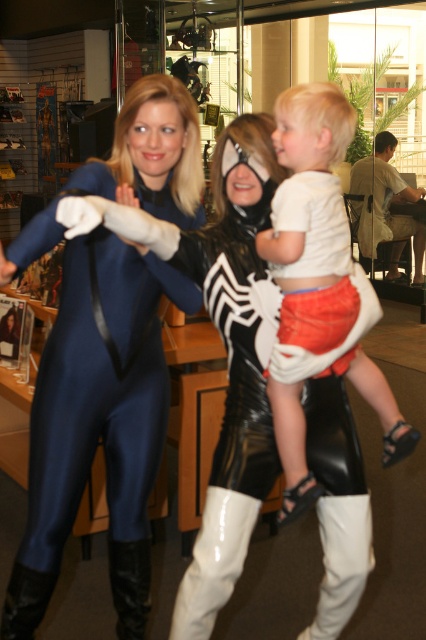
Does shiny blue bodysuit at center lie behind black leather boot at lower center?

No.

What do you see at coordinates (94, 410) in the screenshot?
I see `shiny blue bodysuit at center` at bounding box center [94, 410].

Which is behind, point (95, 444) or point (140, 556)?

Positioned behind is point (140, 556).

At what (x,y) coordinates should I click in order to perform the action: click on shiny blue bodysuit at center. Please return your answer as a coordinate pair (x, y). This screenshot has width=426, height=640. Looking at the image, I should click on (94, 410).

Can you confirm if shiny blue bodysuit at center is smaller than white cotton shirt at upper center?

Actually, shiny blue bodysuit at center might be larger than white cotton shirt at upper center.

Who is more distant from viewer, (54, 337) or (285, 109)?

The point (54, 337) is more distant.

Image resolution: width=426 pixels, height=640 pixels. What do you see at coordinates (94, 410) in the screenshot?
I see `shiny blue bodysuit at center` at bounding box center [94, 410].

This screenshot has width=426, height=640. Find the location of `shiny blue bodysuit at center`. shiny blue bodysuit at center is located at coordinates (94, 410).

Does white cotton shirt at upper center come behind black leather boot at lower center?

No, it is not.

Is white cotton shirt at upper center above black leather boot at lower center?

Indeed, white cotton shirt at upper center is positioned over black leather boot at lower center.

Locate an element on the screen. white cotton shirt at upper center is located at coordinates (316, 282).

Image resolution: width=426 pixels, height=640 pixels. Find the location of `white cotton shirt at upper center`. white cotton shirt at upper center is located at coordinates (316, 282).